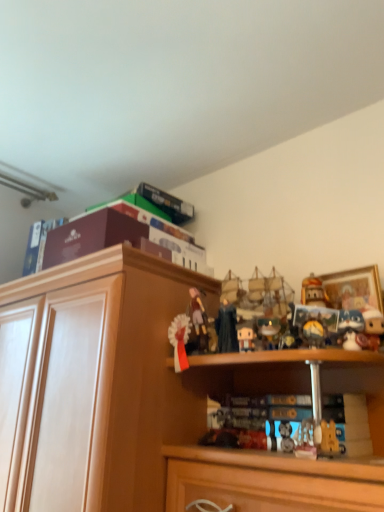
Question: Is dark blue fabric figurine at center, the third toy in the left-to-right sequence, to the left or to the right of maroon cardboard box at upper left, the fourth book positioned from the right, in the image?

Choices:
 (A) right
 (B) left

Answer: (A)

Question: In the image, is dark blue fabric figurine at center, the third toy in the left-to-right sequence, positioned in front of or behind maroon cardboard box at upper left, which is the first book in left-to-right order?

Choices:
 (A) front
 (B) behind

Answer: (A)

Question: Considering the real-world distances, which object is farthest from the wooden cabinet at upper center?

Choices:
 (A) white glossy ribbon at center, which ranks as the fifth toy in right-to-left order
 (B) wooden framed picture at upper right
 (C) matte plastic book at lower center, positioned as the first book in right-to-left order
 (D) white plush toy at right, the first toy positioned from the right
 (E) hardcover book at upper center, the third book from the left

Answer: (D)

Question: Which object is positioned farthest from the maroon cardboard box at upper left, which is the first book in left-to-right order?

Choices:
 (A) white matte figurine at center, which is counted as the 2th toy, starting from the right
 (B) hardcover book at upper center, the third book from the left
 (C) maroon cardboard box at upper left, the 2th book positioned from the left
 (D) white plush toy at right, the first toy positioned from the right
 (E) matte plastic book at lower center, the fourth book positioned from the left

Answer: (D)